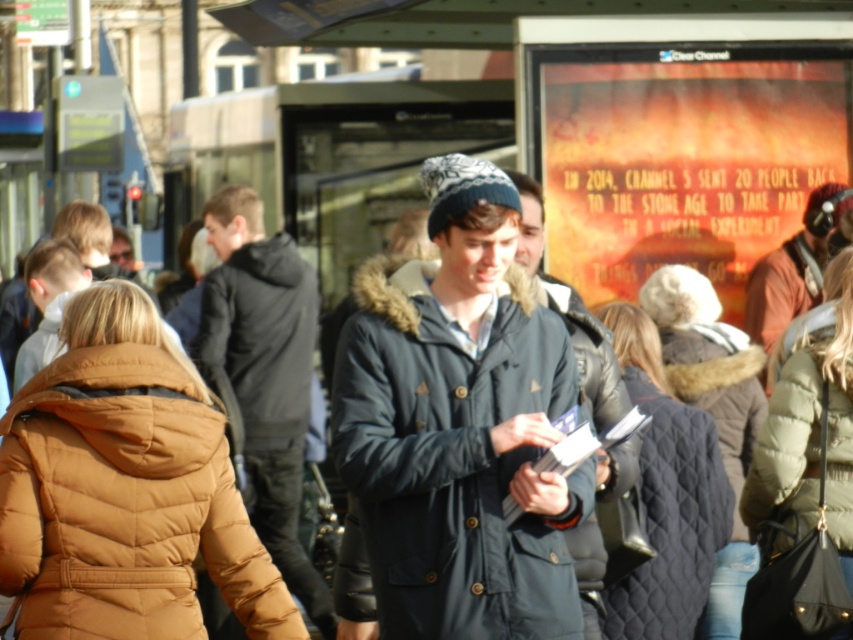
Between orange fabric poster at upper right and dark blue quilted jacket at center, which one has less height?

orange fabric poster at upper right is shorter.

Does orange fabric poster at upper right have a greater width compared to dark blue quilted jacket at center?

No.

Measure the distance between point (x=665, y=86) and camera.

The distance of point (x=665, y=86) from camera is 38.58 meters.

Find the location of `orange fabric poster at upper right`. orange fabric poster at upper right is located at coordinates (683, 164).

Is point (376, 428) closer to camera compared to point (454, 307)?

Yes, point (376, 428) is closer to viewer.

Measure the distance between navy blue quilted jacket at center and camera.

The distance of navy blue quilted jacket at center from camera is 92.95 feet.

Locate an element on the screen. The width and height of the screenshot is (853, 640). navy blue quilted jacket at center is located at coordinates (448, 464).

Does brown quilted jacket at lower left appear on the right side of quilted black jacket at center?

Incorrect, brown quilted jacket at lower left is not on the right side of quilted black jacket at center.

What do you see at coordinates (125, 506) in the screenshot? I see `brown quilted jacket at lower left` at bounding box center [125, 506].

Is point (96, 552) farther from viewer compared to point (637, 637)?

That is False.

Where is `brown quilted jacket at lower left`? brown quilted jacket at lower left is located at coordinates (125, 506).